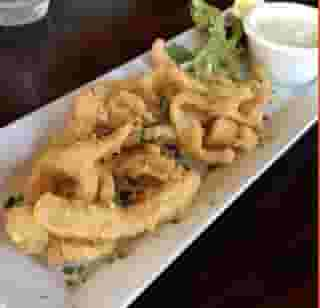
Where is `rectangle serving platter`? The height and width of the screenshot is (308, 320). rectangle serving platter is located at coordinates (204, 214), (38, 128), (309, 97), (10, 268).